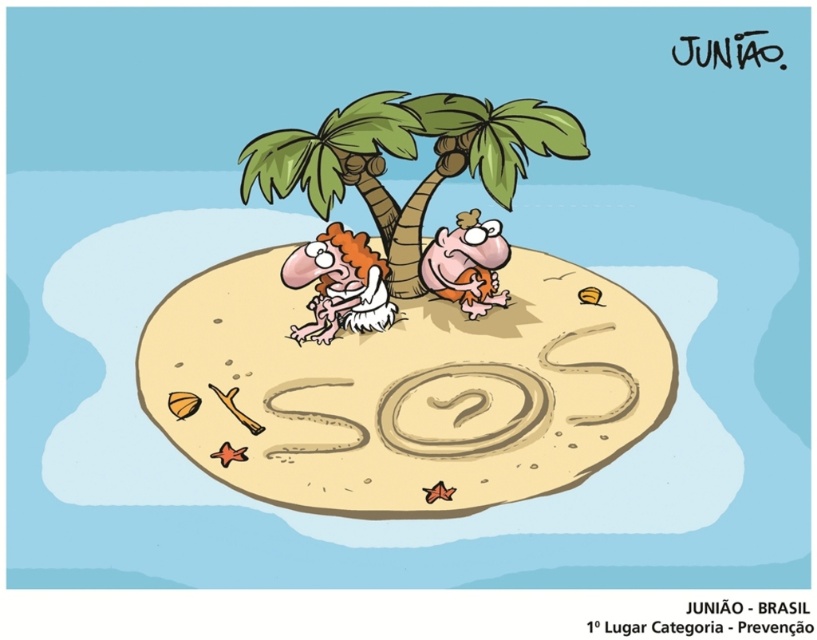
Question: Which is nearer to the white fur animal at center?

Choices:
 (A) orange fabric monkey at center
 (B) green leafy palm tree at upper center

Answer: (A)

Question: Which point is farther to the camera?

Choices:
 (A) green leafy palm tree at upper center
 (B) white fur animal at center
 (C) orange fabric monkey at center

Answer: (C)

Question: Is the position of green leafy palm tree at upper center less distant than that of white fur animal at center?

Choices:
 (A) yes
 (B) no

Answer: (A)

Question: Is green leafy palm tree at upper center below orange fabric monkey at center?

Choices:
 (A) no
 (B) yes

Answer: (A)

Question: Is green leafy palm tree at upper center bigger than white fur animal at center?

Choices:
 (A) no
 (B) yes

Answer: (B)

Question: Which point is farther to the camera?

Choices:
 (A) (474, 282)
 (B) (288, 273)

Answer: (A)